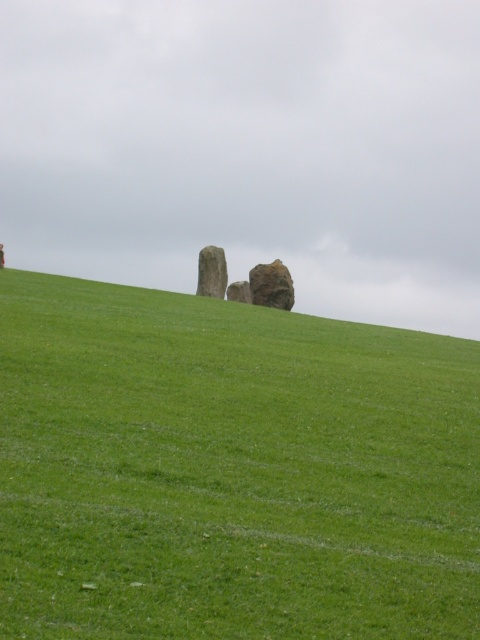
You are planning to place a small garden ornament that requires a base width of 1 meter. Based on the scene, which object between the green grassy hill at center and the smooth gray rock at center would provide a more stable and wider base for the ornament?

The green grassy hill at center might be wider than smooth gray rock at center, so it would provide a more stable and wider base for the ornament.

From the picture: You are standing on the green grassy hill at center and want to move to the rough textured rock at center. Which direction should you move to reach it?

You should move to your right to reach the rough textured rock at center because the green grassy hill at center is to the left of it.

You are standing at the origin point of the coordinate system in the image. You want to place a new object at the same 2D location as the rough textured rock at center. What are the coordinates where you should place the new object?

The coordinates for the rough textured rock at center are at point (x=272, y=285). Therefore, you should place the new object at coordinates (x=272, y=285).